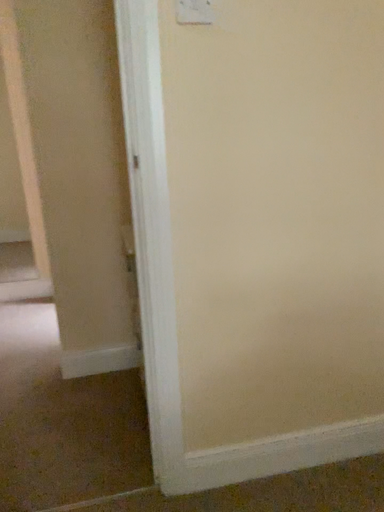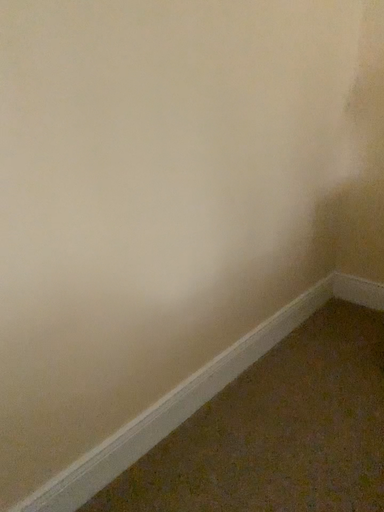
Question: Which way did the camera rotate in the video?

Choices:
 (A) rotated left
 (B) rotated right

Answer: (B)